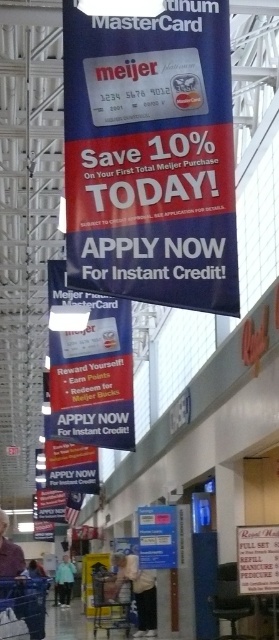
Which is more to the right, blue glossy mastercard at center or blue plastic sign at center?

blue plastic sign at center is more to the right.

Is blue glossy mastercard at center to the right of blue plastic sign at center from the viewer's perspective?

Incorrect, blue glossy mastercard at center is not on the right side of blue plastic sign at center.

Is point (107, 26) positioned behind point (166, 541)?

No, (107, 26) is in front of (166, 541).

The width and height of the screenshot is (279, 640). What are the coordinates of `blue glossy mastercard at center` in the screenshot? It's located at (150, 156).

Between blue plastic sign at center and light blue fabric at lower center, which one appears on the right side from the viewer's perspective?

blue plastic sign at center

Measure the distance between point (x=162, y=568) and camera.

Point (x=162, y=568) and camera are 58.27 feet apart from each other.

Locate an element on the screen. blue plastic sign at center is located at coordinates (157, 536).

Who is taller, matte plastic mastercard at center or white paper sign at lower right?

matte plastic mastercard at center

Which is more to the right, matte plastic mastercard at center or white paper sign at lower right?

From the viewer's perspective, white paper sign at lower right appears more on the right side.

Is point (63, 353) closer to viewer compared to point (275, 568)?

That is False.

The height and width of the screenshot is (640, 279). I want to click on matte plastic mastercard at center, so click(x=90, y=369).